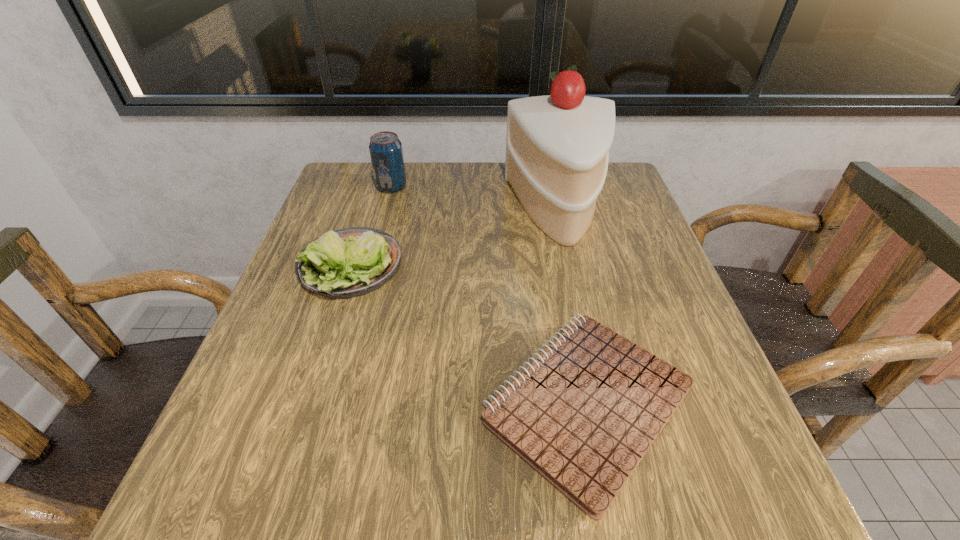
Identify the location of free space between the lettuce and the nearest object. Image resolution: width=960 pixels, height=540 pixels. (469, 335).

Identify the location of free space that is in between the lettuce and the shortest object. (469, 335).

The image size is (960, 540). In order to click on vacant point located between the cake and the pop soda in this screenshot , I will do `click(475, 199)`.

The width and height of the screenshot is (960, 540). Identify the location of free space between the pop soda and the lettuce. (372, 227).

At what (x,y) coordinates should I click in order to perform the action: click on free space between the shortest object and the third tallest object. Please return your answer as a coordinate pair (x, y). Looking at the image, I should click on (469, 335).

Locate an element on the screen. This screenshot has width=960, height=540. vacant space in between the second tallest object and the second shortest object is located at coordinates (372, 227).

You are a GUI agent. You are given a task and a screenshot of the screen. Output one action in this format:
    pyautogui.click(x=<x>, y=<y>)
    Task: Click on the closest object to the third shortest object
    
    Given the screenshot: What is the action you would take?
    pyautogui.click(x=350, y=262)

I want to click on object that is the second closest to the lettuce, so click(583, 414).

What are the coordinates of `vacant space that satisfies the following two spatial constraints: 1. on the front side of the notebook; 2. on the right side of the third shortest object` in the screenshot? It's located at (332, 403).

You are a GUI agent. You are given a task and a screenshot of the screen. Output one action in this format:
    pyautogui.click(x=<x>, y=<y>)
    Task: Click on the free point that satisfies the following two spatial constraints: 1. on the back side of the second tallest object; 2. on the left side of the second shortest object
    The height and width of the screenshot is (540, 960).
    Given the screenshot: What is the action you would take?
    pyautogui.click(x=376, y=187)